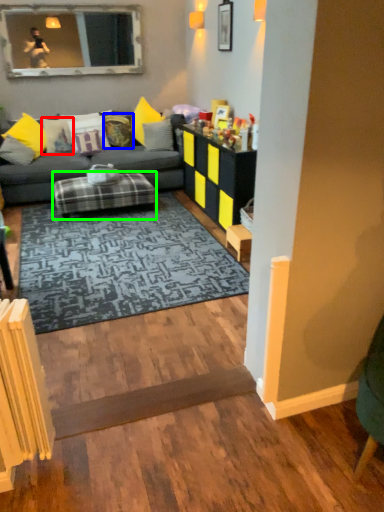
Question: Considering the real-world distances, which object is farthest from pillow (highlighted by a red box)? pillow (highlighted by a blue box) or table (highlighted by a green box)?

Choices:
 (A) pillow
 (B) table

Answer: (B)